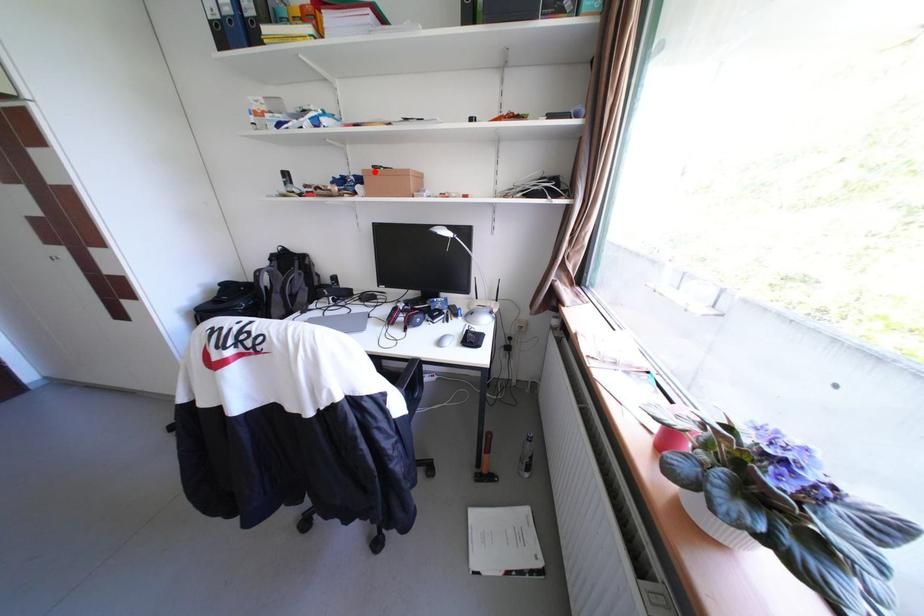
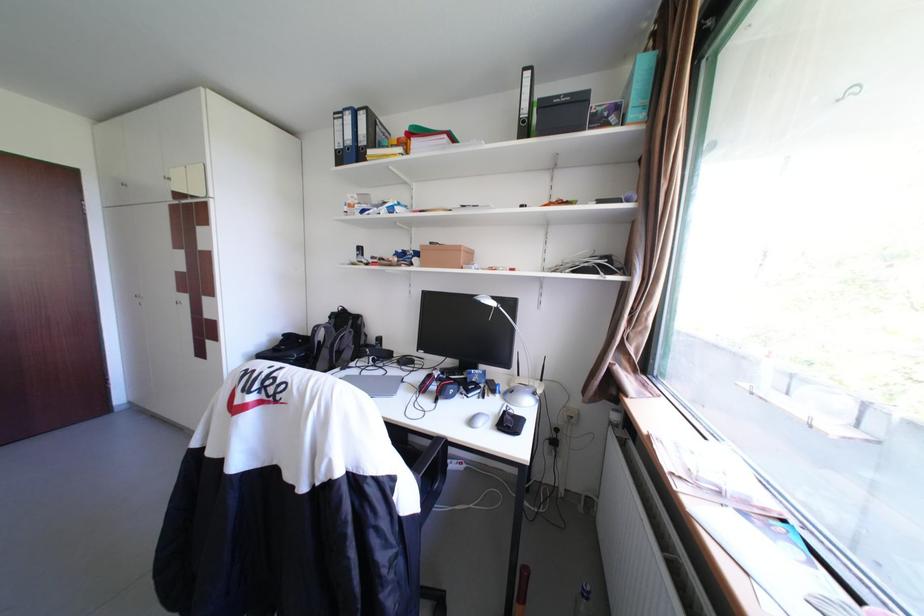
Question: I am providing you with two images of the same scene from different viewpoints. A red point is marked on the first image. At the location where the point appears in image 1, is it still visible in image 2?

Choices:
 (A) Yes
 (B) No

Answer: (A)